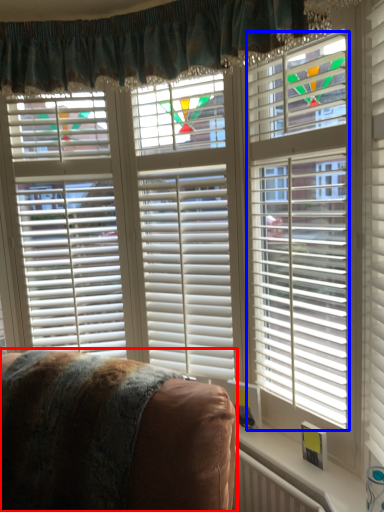
Question: Which point is closer to the camera, furniture (highlighted by a red box) or blind (highlighted by a blue box)?

Choices:
 (A) furniture
 (B) blind

Answer: (A)